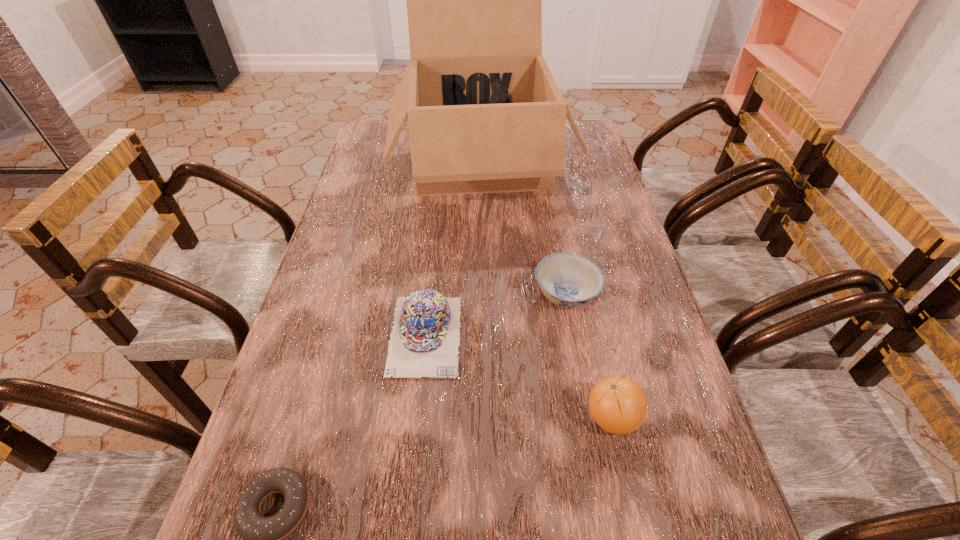
You are a GUI agent. You are given a task and a screenshot of the screen. Output one action in this format:
    pyautogui.click(x=<x>, y=<y>)
    Task: Click on the object positioned at the far edge
    The image size is (960, 540).
    Given the screenshot: What is the action you would take?
    pyautogui.click(x=485, y=115)

Identify the location of object at the left edge. The image size is (960, 540). (485, 115).

The height and width of the screenshot is (540, 960). I want to click on box situated at the right edge, so click(x=485, y=115).

You are a GUI agent. You are given a task and a screenshot of the screen. Output one action in this format:
    pyautogui.click(x=<x>, y=<y>)
    Task: Click on the orange that is at the right edge
    
    Given the screenshot: What is the action you would take?
    pyautogui.click(x=618, y=405)

The height and width of the screenshot is (540, 960). In order to click on bowl at the right edge in this screenshot , I will do `click(568, 280)`.

Find the location of `object that is positioned at the far left corner`. object that is positioned at the far left corner is located at coordinates (485, 115).

The height and width of the screenshot is (540, 960). I want to click on object that is at the far right corner, so click(x=485, y=115).

Identify the location of vacant space at the left edge of the desktop. This screenshot has height=540, width=960. (393, 164).

The width and height of the screenshot is (960, 540). What are the coordinates of `free space at the right edge` in the screenshot? It's located at (593, 166).

This screenshot has height=540, width=960. What are the coordinates of `free spot between the cap and the second nearest object` in the screenshot? It's located at (518, 376).